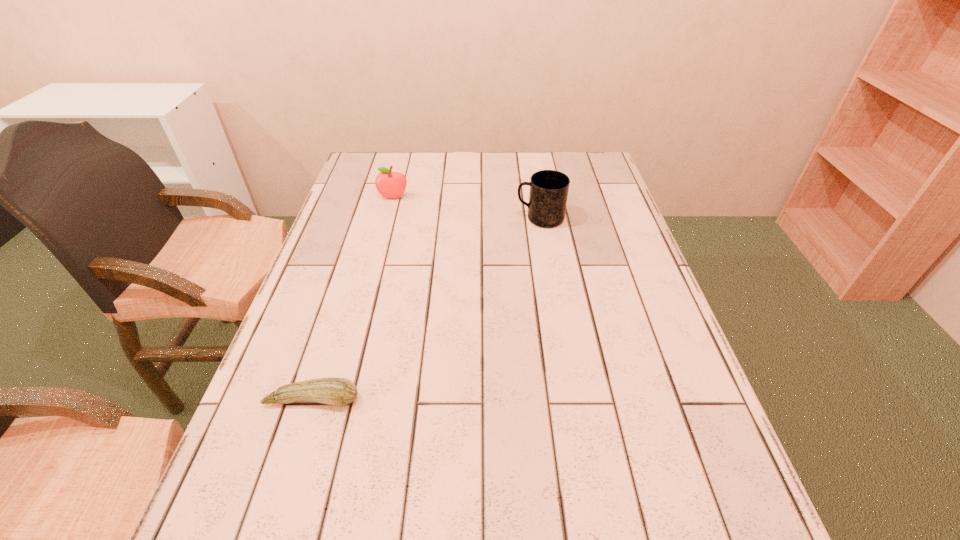
This screenshot has height=540, width=960. I want to click on the rightmost object, so click(549, 189).

Locate an element on the screen. This screenshot has height=540, width=960. mug is located at coordinates (549, 189).

I want to click on the second shortest object, so click(x=389, y=184).

Locate an element on the screen. The image size is (960, 540). apple is located at coordinates tap(389, 184).

This screenshot has width=960, height=540. Identify the location of zucchini. (335, 391).

At what (x,y) coordinates should I click in order to perform the action: click on the nearest object. Please return your answer as a coordinate pair (x, y). The image size is (960, 540). Looking at the image, I should click on (335, 391).

Locate an element on the screen. The image size is (960, 540). free space located on the side of the rightmost object with the handle is located at coordinates (426, 218).

Where is `free space located on the side of the rightmost object with the handle`? The width and height of the screenshot is (960, 540). free space located on the side of the rightmost object with the handle is located at coordinates (402, 218).

This screenshot has width=960, height=540. What are the coordinates of `free region located 0.390m on the side of the rightmost object with the handle` in the screenshot? It's located at (381, 218).

Find the location of `vacant space located on the right of the apple`. vacant space located on the right of the apple is located at coordinates (428, 198).